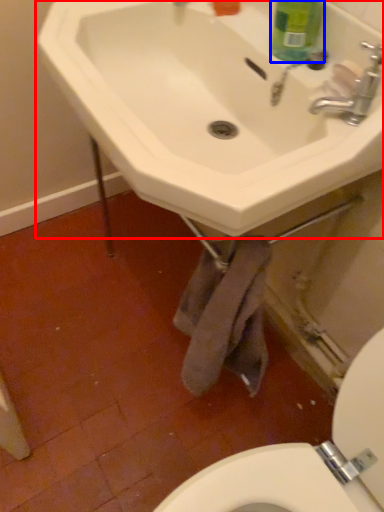
Question: Which point is further to the camera, sink (highlighted by a red box) or cleaning product (highlighted by a blue box)?

Choices:
 (A) sink
 (B) cleaning product

Answer: (B)